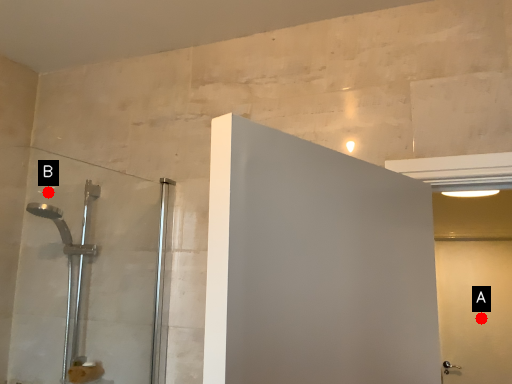
Question: Two points are circled on the image, labeled by A and B beside each circle. Among these points, which one is farthest from the camera?

Choices:
 (A) A is further
 (B) B is further

Answer: (A)